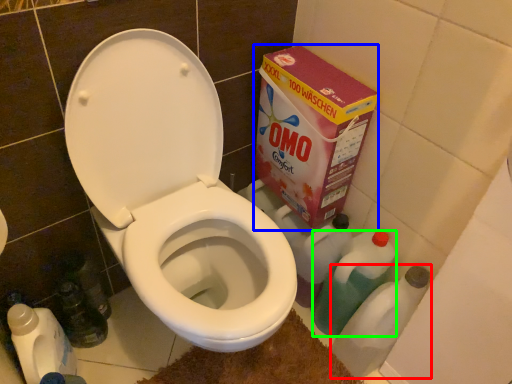
Question: Considering the real-world distances, which object is farthest from bottle (highlighted by a red box)? cardboard box (highlighted by a blue box) or cleaning product (highlighted by a green box)?

Choices:
 (A) cardboard box
 (B) cleaning product

Answer: (A)